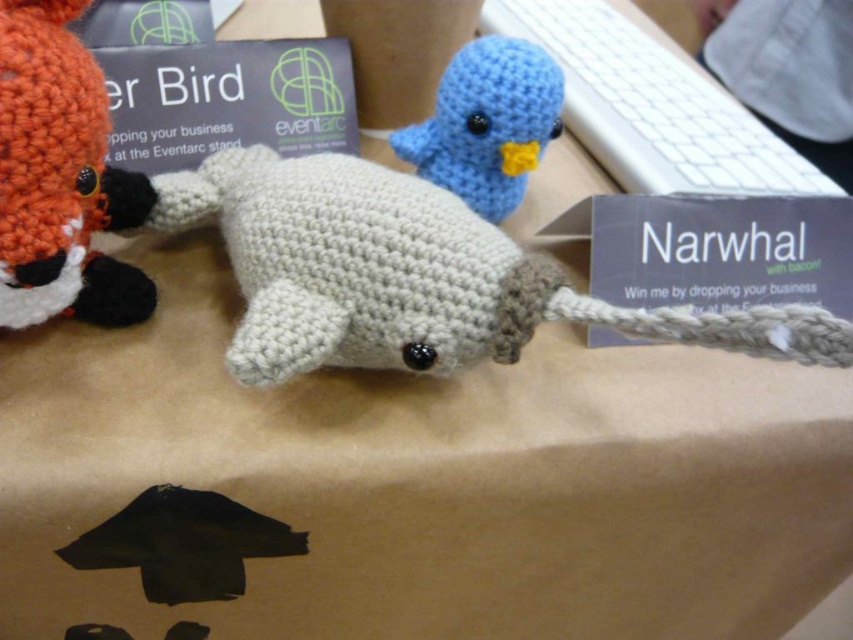
Describe the element at coordinates (61, 177) in the screenshot. This screenshot has height=640, width=853. I see `orange yarn fox at left` at that location.

At what (x,y) coordinates should I click in order to perform the action: click on orange yarn fox at left. Please return your answer as a coordinate pair (x, y). Looking at the image, I should click on (61, 177).

What do you see at coordinates (415, 275) in the screenshot? This screenshot has height=640, width=853. I see `white yarn narwhal at center` at bounding box center [415, 275].

This screenshot has height=640, width=853. What are the coordinates of `white yarn narwhal at center` in the screenshot? It's located at [415, 275].

Is the position of white yarn narwhal at center more distant than that of orange yarn fox at left?

That is False.

Does white yarn narwhal at center come in front of orange yarn fox at left?

Yes, it is.

Identify the location of white yarn narwhal at center. (415, 275).

This screenshot has width=853, height=640. I want to click on white yarn narwhal at center, so click(415, 275).